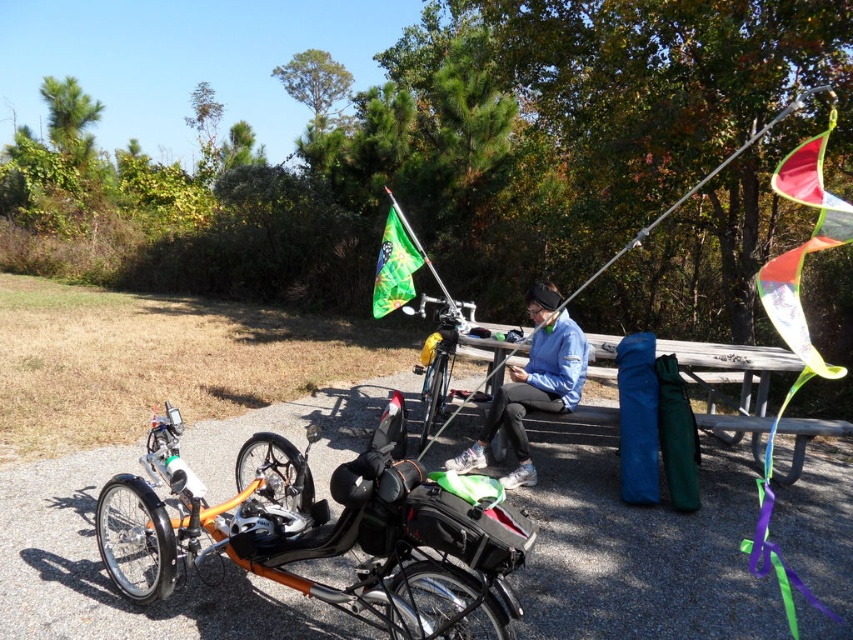
Does orange matte trike at lower left appear on the right side of green fabric flag at center?

Incorrect, orange matte trike at lower left is not on the right side of green fabric flag at center.

Who is more distant from viewer, (x=231, y=556) or (x=380, y=246)?

The point (x=380, y=246) is behind.

Where is `orange matte trike at lower left`? The height and width of the screenshot is (640, 853). orange matte trike at lower left is located at coordinates (318, 534).

Can you confirm if blue fabric jacket at center is bigger than yellow matte bicycle at center?

Correct, blue fabric jacket at center is larger in size than yellow matte bicycle at center.

In order to click on blue fabric jacket at center in this screenshot , I will do `click(532, 387)`.

Locate an element on the screen. This screenshot has width=853, height=640. blue fabric jacket at center is located at coordinates (532, 387).

Does orange matte trike at lower left appear on the right side of blue fabric jacket at center?

No, orange matte trike at lower left is not to the right of blue fabric jacket at center.

Which is behind, point (451, 593) or point (532, 467)?

The point (532, 467) is more distant.

Which is behind, point (514, 547) or point (524, 397)?

Positioned behind is point (524, 397).

Where is `orange matte trike at lower left`? This screenshot has height=640, width=853. orange matte trike at lower left is located at coordinates (318, 534).